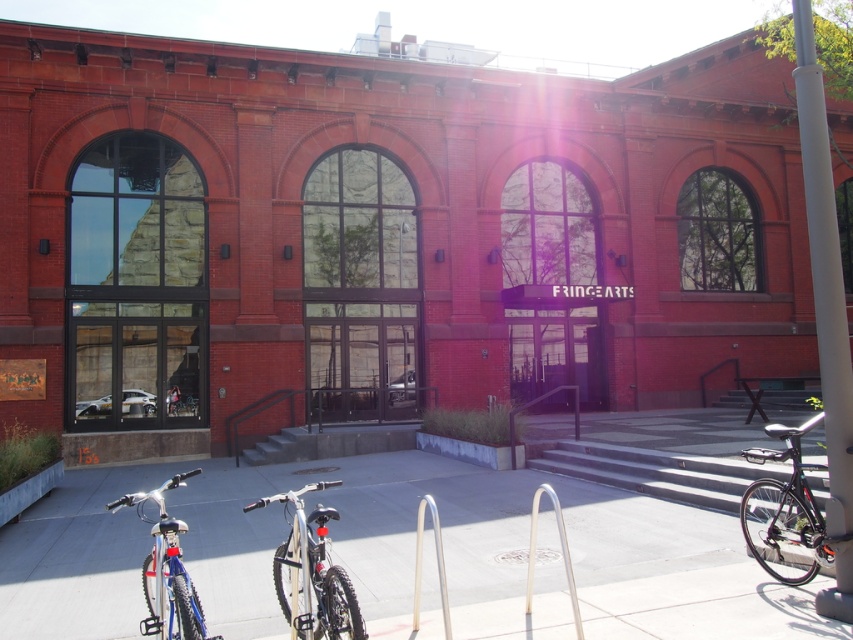
Can you confirm if shiny silver bicycle at center is positioned below shiny blue bike at lower left?

Actually, shiny silver bicycle at center is above shiny blue bike at lower left.

Is shiny silver bicycle at center bigger than shiny blue bike at lower left?

Incorrect, shiny silver bicycle at center is not larger than shiny blue bike at lower left.

Who is more distant from viewer, (x=321, y=625) or (x=165, y=520)?

Point (x=321, y=625)

At what (x,y) coordinates should I click in order to perform the action: click on shiny silver bicycle at center. Please return your answer as a coordinate pair (x, y). The image size is (853, 640). Looking at the image, I should click on (312, 572).

Measure the distance between point [277,554] and camera.

Point [277,554] and camera are 5.03 meters apart.

Does point (322, 609) lie in front of point (579, 618)?

That is True.

Find the location of a particular element. The width and height of the screenshot is (853, 640). shiny silver bicycle at center is located at coordinates (312, 572).

Which of these two, smooth concrete pavement at center or shiny silver bicycle at center, stands taller?

With more height is smooth concrete pavement at center.

Does smooth concrete pavement at center have a greater width compared to shiny silver bicycle at center?

Indeed, smooth concrete pavement at center has a greater width compared to shiny silver bicycle at center.

Is point (206, 509) less distant than point (325, 481)?

Yes, it is.

Identify the location of smooth concrete pavement at center. (383, 548).